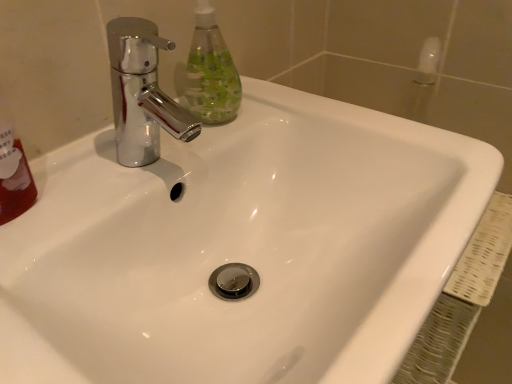
The height and width of the screenshot is (384, 512). What do you see at coordinates (142, 93) in the screenshot? I see `chrome metallic faucet at upper left` at bounding box center [142, 93].

Locate an element on the screen. chrome metallic faucet at upper left is located at coordinates (142, 93).

Identify the location of clear plastic bottle at upper left. The width and height of the screenshot is (512, 384). (210, 72).

The image size is (512, 384). What do you see at coordinates (210, 72) in the screenshot?
I see `clear plastic bottle at upper left` at bounding box center [210, 72].

Locate an element on the screen. The image size is (512, 384). chrome metallic faucet at upper left is located at coordinates [x=142, y=93].

In the scene shown: Considering the relative positions of chrome metallic faucet at upper left and clear plastic bottle at upper left in the image provided, is chrome metallic faucet at upper left to the right of clear plastic bottle at upper left from the viewer's perspective?

No.

From the picture: Which object is further away from the camera, chrome metallic faucet at upper left or clear plastic bottle at upper left?

clear plastic bottle at upper left.

Which point is more distant from viewer, (140, 75) or (238, 98)?

Positioned behind is point (140, 75).

From the image's perspective, is chrome metallic faucet at upper left positioned above or below clear plastic bottle at upper left?

chrome metallic faucet at upper left is below clear plastic bottle at upper left.

From a real-world perspective, is chrome metallic faucet at upper left positioned above or below clear plastic bottle at upper left?

In terms of real-world spatial position, chrome metallic faucet at upper left is below clear plastic bottle at upper left.

Considering the sizes of objects chrome metallic faucet at upper left and clear plastic bottle at upper left in the image provided, who is wider, chrome metallic faucet at upper left or clear plastic bottle at upper left?

With larger width is chrome metallic faucet at upper left.

Considering the sizes of objects chrome metallic faucet at upper left and clear plastic bottle at upper left in the image provided, who is shorter, chrome metallic faucet at upper left or clear plastic bottle at upper left?

chrome metallic faucet at upper left is shorter.

Considering the sizes of objects chrome metallic faucet at upper left and clear plastic bottle at upper left in the image provided, who is bigger, chrome metallic faucet at upper left or clear plastic bottle at upper left?

With larger size is chrome metallic faucet at upper left.

Choose the correct answer: Is chrome metallic faucet at upper left inside clear plastic bottle at upper left or outside it?

chrome metallic faucet at upper left lies outside clear plastic bottle at upper left.

Does chrome metallic faucet at upper left touch clear plastic bottle at upper left?

Yes.

Consider the image. Is chrome metallic faucet at upper left facing towards clear plastic bottle at upper left?

No, chrome metallic faucet at upper left does not turn towards clear plastic bottle at upper left.

Locate an element on the screen. The image size is (512, 384). tap in front of the clear plastic bottle at upper left is located at coordinates tap(142, 93).

Is clear plastic bottle at upper left at the right side of chrome metallic faucet at upper left?

Yes, clear plastic bottle at upper left is to the right of chrome metallic faucet at upper left.

Is the depth of clear plastic bottle at upper left greater than that of chrome metallic faucet at upper left?

Yes, it is behind chrome metallic faucet at upper left.

Does point (222, 39) appear closer or farther from the camera than point (147, 82)?

Point (222, 39) is positioned closer to the camera compared to point (147, 82).

From the image's perspective, which object appears higher, clear plastic bottle at upper left or chrome metallic faucet at upper left?

clear plastic bottle at upper left.

From a real-world perspective, is clear plastic bottle at upper left above or below chrome metallic faucet at upper left?

clear plastic bottle at upper left is above chrome metallic faucet at upper left.

Does clear plastic bottle at upper left have a greater width compared to chrome metallic faucet at upper left?

No, clear plastic bottle at upper left is not wider than chrome metallic faucet at upper left.

Based on the photo, from their relative heights in the image, would you say clear plastic bottle at upper left is taller or shorter than chrome metallic faucet at upper left?

clear plastic bottle at upper left is taller than chrome metallic faucet at upper left.

Who is bigger, clear plastic bottle at upper left or chrome metallic faucet at upper left?

Bigger between the two is chrome metallic faucet at upper left.

Is clear plastic bottle at upper left inside the boundaries of chrome metallic faucet at upper left, or outside?

clear plastic bottle at upper left exists outside the volume of chrome metallic faucet at upper left.

Can you see clear plastic bottle at upper left touching chrome metallic faucet at upper left?

Yes, clear plastic bottle at upper left is touching chrome metallic faucet at upper left.

Could you tell me if clear plastic bottle at upper left is facing chrome metallic faucet at upper left?

No, clear plastic bottle at upper left is not aimed at chrome metallic faucet at upper left.

How different are the orientations of clear plastic bottle at upper left and chrome metallic faucet at upper left in degrees?

0.000325 degrees.

I want to click on tap in front of the clear plastic bottle at upper left, so click(x=142, y=93).

Image resolution: width=512 pixels, height=384 pixels. Identify the location of tap in front of the clear plastic bottle at upper left. (142, 93).

Where is `cleaning product behind the chrome metallic faucet at upper left`? Image resolution: width=512 pixels, height=384 pixels. cleaning product behind the chrome metallic faucet at upper left is located at coordinates (210, 72).